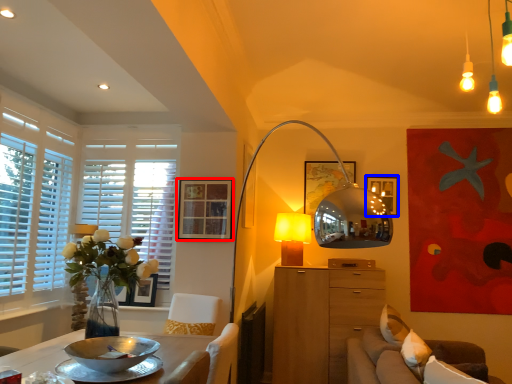
Question: Which point is closer to the camera, picture frame (highlighted by a red box) or picture frame (highlighted by a blue box)?

Choices:
 (A) picture frame
 (B) picture frame

Answer: (A)